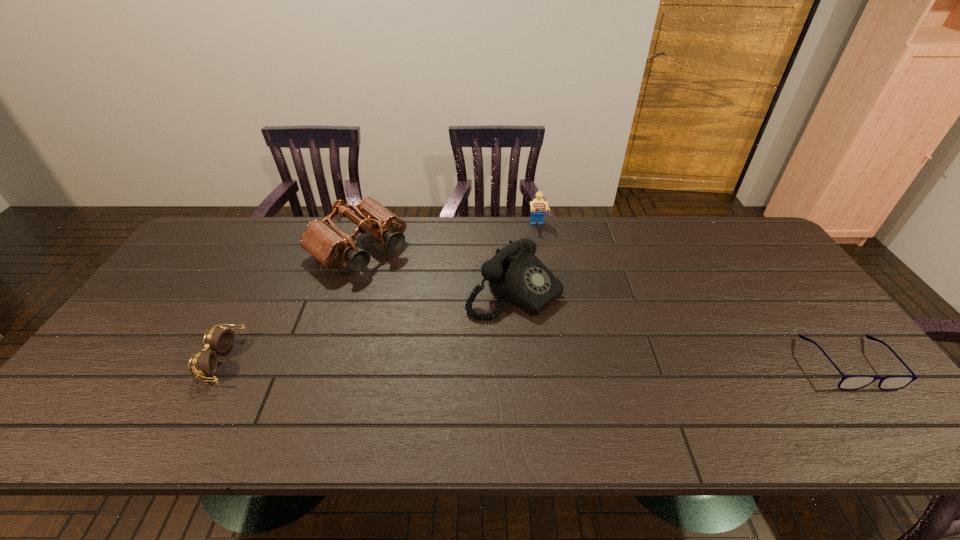
Identify the location of the fourth tallest object. The width and height of the screenshot is (960, 540). (203, 363).

I want to click on the leftmost object, so click(x=203, y=363).

Locate an element on the screen. The height and width of the screenshot is (540, 960). spectacles is located at coordinates (849, 382).

In order to click on the rightmost object in this screenshot , I will do pos(849,382).

Where is `telephone`? telephone is located at coordinates (514, 273).

At what (x,y) coordinates should I click in order to perform the action: click on the fourth object from right to left. Please return your answer as a coordinate pair (x, y). Looking at the image, I should click on (322, 239).

In order to click on Lego in this screenshot , I will do `click(537, 205)`.

You are a GUI agent. You are given a task and a screenshot of the screen. Output one action in this format:
    pyautogui.click(x=<x>, y=<y>)
    Task: Click on the vacant space located 0.120m through the lenses of the second shortest object
    
    Given the screenshot: What is the action you would take?
    pyautogui.click(x=157, y=360)

The image size is (960, 540). Identify the location of free space located through the lenses of the second shortest object. (161, 360).

I want to click on blank area located through the lenses of the second shortest object, so click(x=186, y=360).